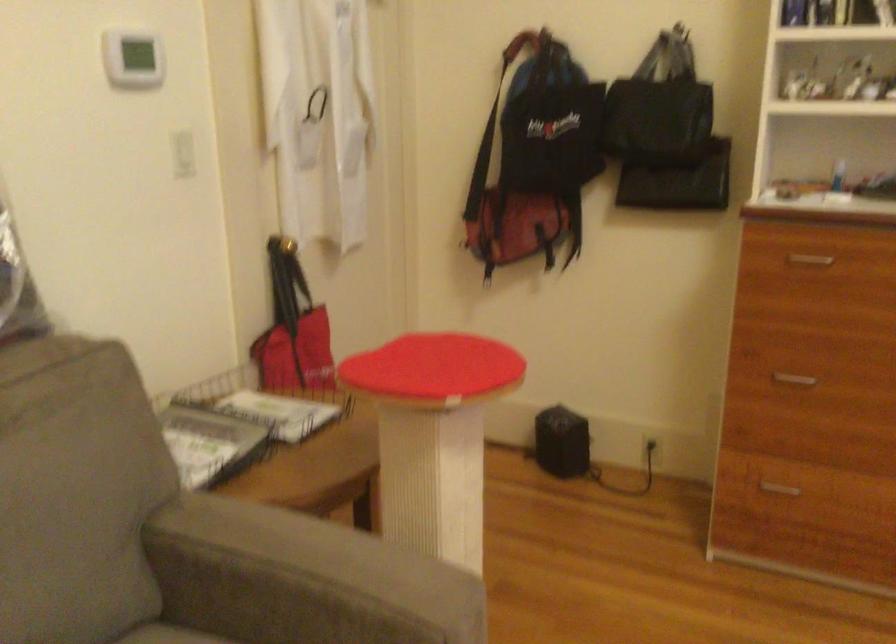
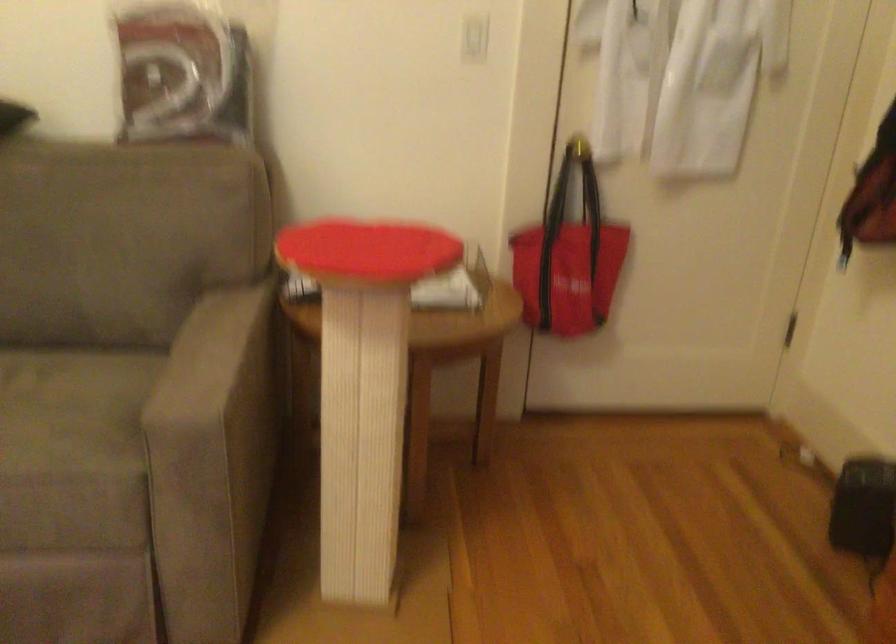
In the second image, find the point that corresponds to pixel 357 565 in the first image.

(212, 360)